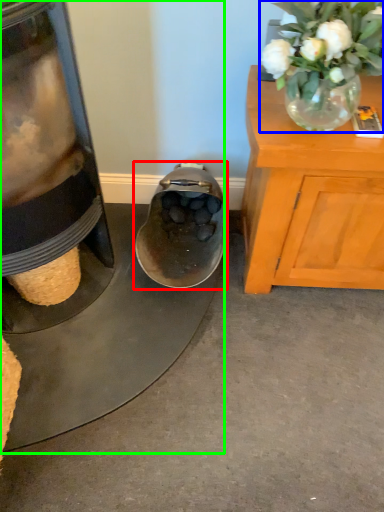
Question: Considering the real-world distances, which object is closest to footwear (highlighted by a red box)? floral arrangement (highlighted by a blue box) or appliance (highlighted by a green box).

Choices:
 (A) floral arrangement
 (B) appliance

Answer: (B)